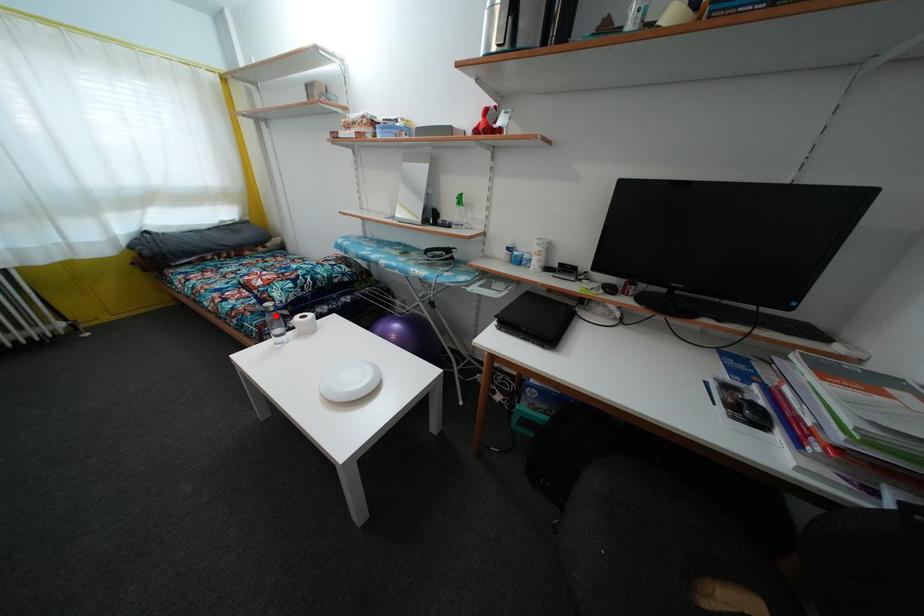
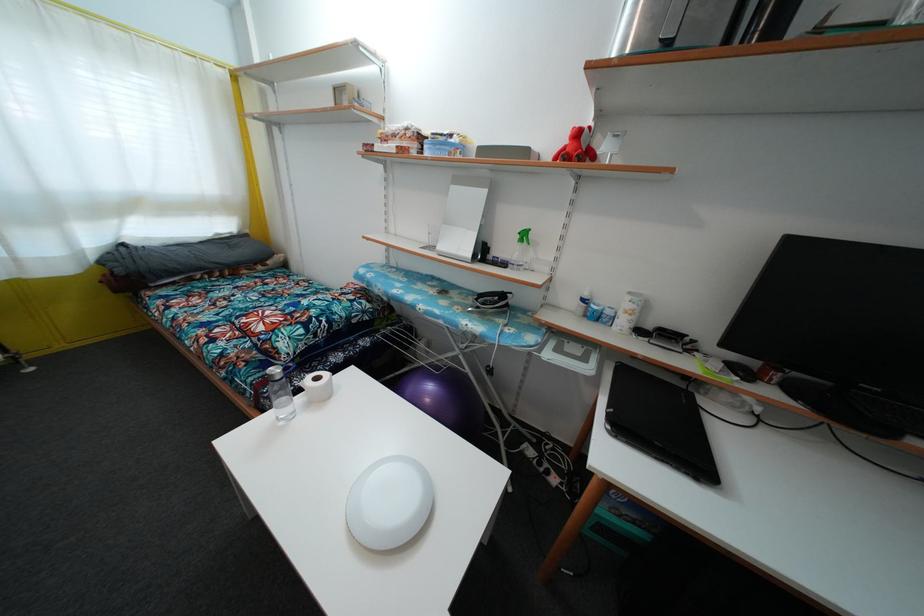
Question: I am providing you with two images of the same scene from different viewpoints. A red point is shown in image1. For the corresponding object point in image2, is it positioned nearer or farther from the camera?

Choices:
 (A) Nearer
 (B) Farther

Answer: (A)